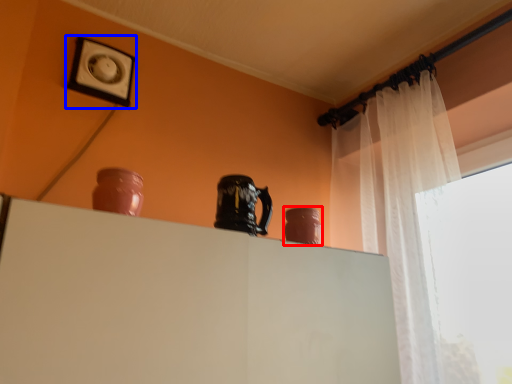
Question: Among these objects, which one is nearest to the camera, vase (highlighted by a red box) or picture frame (highlighted by a blue box)?

Choices:
 (A) vase
 (B) picture frame

Answer: (A)